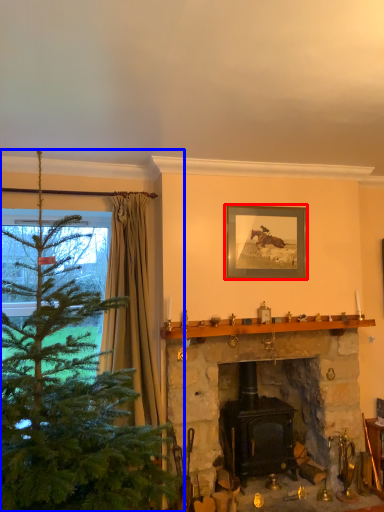
Question: Which object is further to the camera taking this photo, picture frame (highlighted by a red box) or christmas tree (highlighted by a blue box)?

Choices:
 (A) picture frame
 (B) christmas tree

Answer: (A)